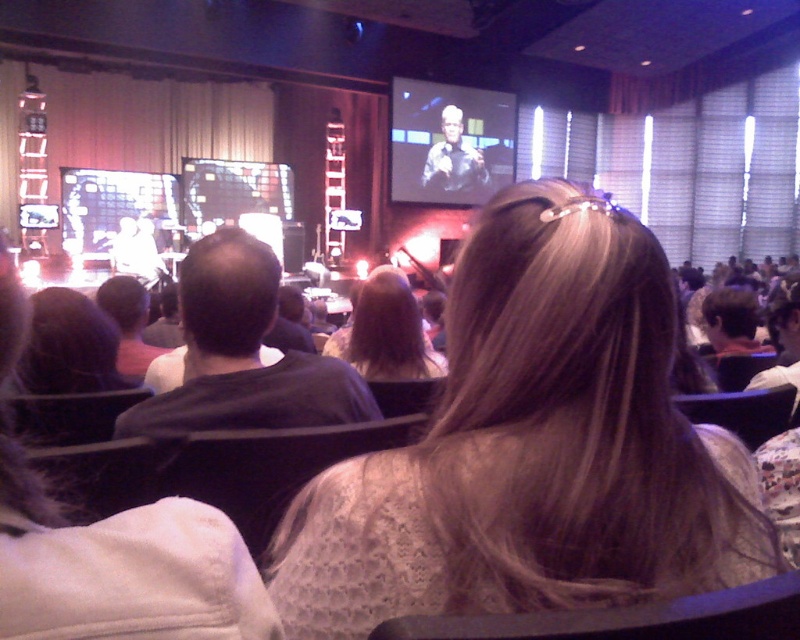
Between white lace dress at center and light brown hair at center, which one has less height?

Standing shorter between the two is light brown hair at center.

Measure the distance between point (474, 381) and camera.

Point (474, 381) and camera are 31.03 inches apart.

This screenshot has height=640, width=800. I want to click on white lace dress at center, so click(x=533, y=448).

Does white lace dress at center appear on the left side of black cotton shirt at left?

Incorrect, white lace dress at center is not on the left side of black cotton shirt at left.

Measure the distance from white lace dress at center to black cotton shirt at left.

white lace dress at center is 24.38 inches away from black cotton shirt at left.

The width and height of the screenshot is (800, 640). Find the location of `white lace dress at center`. white lace dress at center is located at coordinates (533, 448).

Is black cotton shirt at left to the right of light brown hair at center from the viewer's perspective?

Incorrect, black cotton shirt at left is not on the right side of light brown hair at center.

Identify the location of black cotton shirt at left. This screenshot has height=640, width=800. (242, 355).